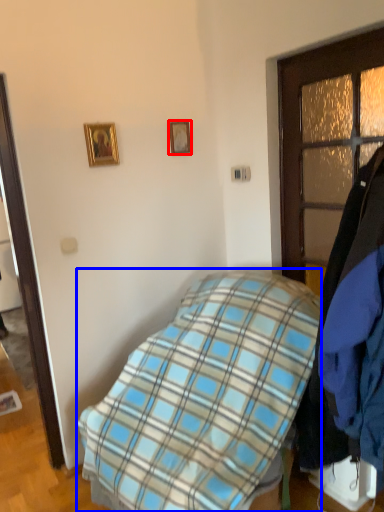
Question: Which of the following is the closest to the observer, picture frame (highlighted by a red box) or bed (highlighted by a blue box)?

Choices:
 (A) picture frame
 (B) bed

Answer: (B)